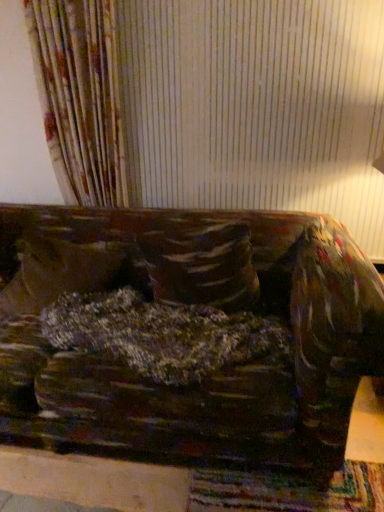
Question: Based on their sizes in the image, would you say velvet-like brown couch at center is bigger or smaller than velvety brown pillow at center, placed as the first pillow when sorted from left to right?

Choices:
 (A) small
 (B) big

Answer: (B)

Question: Considering the positions of point (349, 257) and point (38, 281), is point (349, 257) closer or farther from the camera than point (38, 281)?

Choices:
 (A) farther
 (B) closer

Answer: (B)

Question: Which object is positioned farthest from the velvety brown pillow at center, which is counted as the first pillow, starting from the right?

Choices:
 (A) velvety brown pillow at center, placed as the first pillow when sorted from left to right
 (B) velvet-like brown couch at center

Answer: (A)

Question: Estimate the real-world distances between objects in this image. Which object is farther from the velvety brown pillow at center, the 2th pillow when ordered from right to left?

Choices:
 (A) velvety brown pillow at center, marked as the second pillow in a left-to-right arrangement
 (B) velvet-like brown couch at center

Answer: (A)